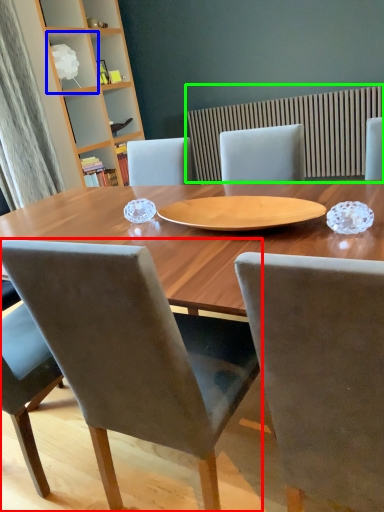
Question: Which object is positioned farthest from chair (highlighted by a red box)? Select from shelf (highlighted by a blue box) and radiator (highlighted by a green box).

Choices:
 (A) shelf
 (B) radiator

Answer: (A)